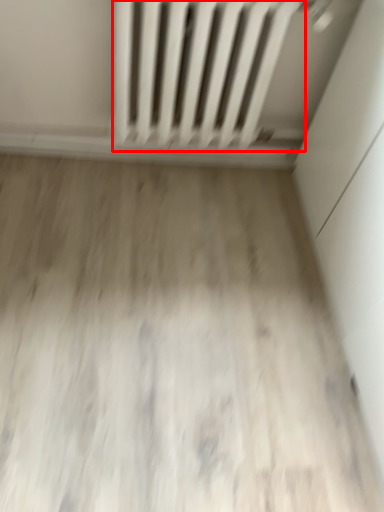
Question: From the image, what is the correct spatial relationship of radiator (annotated by the red box) in relation to plain?

Choices:
 (A) left
 (B) right

Answer: (B)